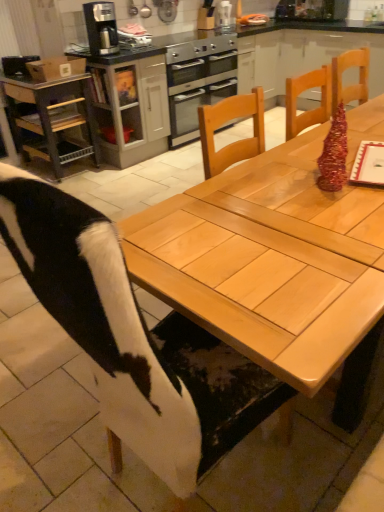
In order to click on vacant space that is to the left of cowhide at center in this screenshot , I will do [54, 433].